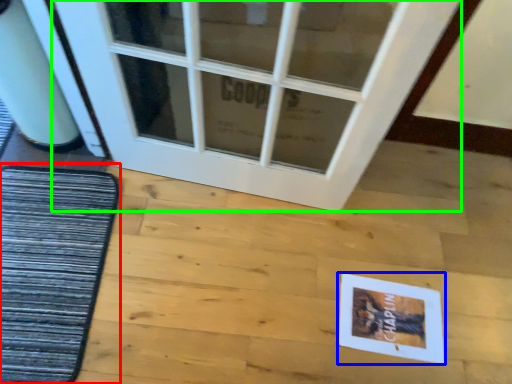
Question: Considering the real-world distances, which object is farthest from mat (highlighted by a red box)? postcard (highlighted by a blue box) or door (highlighted by a green box)?

Choices:
 (A) postcard
 (B) door

Answer: (A)